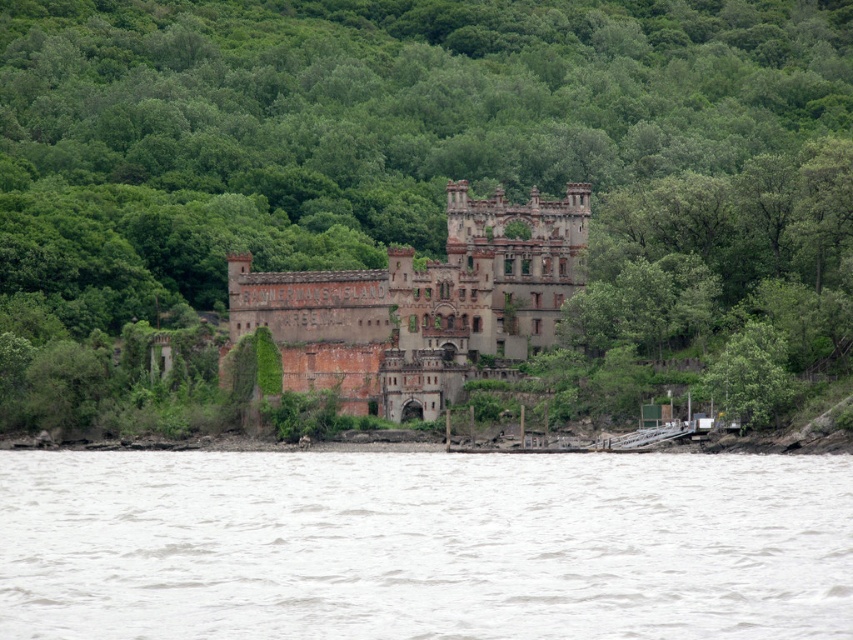
Question: Which of the following is the farthest from the observer?

Choices:
 (A) (294, 68)
 (B) (241, 305)
 (C) (535, 518)

Answer: (A)

Question: Does gray water at lower center appear under rusty brick castle at center?

Choices:
 (A) no
 (B) yes

Answer: (B)

Question: Does green leafy tree at center appear over rusty brick castle at center?

Choices:
 (A) yes
 (B) no

Answer: (A)

Question: Considering the real-world distances, which object is farthest from the rusty brick castle at center?

Choices:
 (A) green leafy tree at center
 (B) gray water at lower center

Answer: (B)

Question: Can you confirm if gray water at lower center is bigger than rusty brick castle at center?

Choices:
 (A) no
 (B) yes

Answer: (A)

Question: Which of the following is the farthest from the observer?

Choices:
 (A) (392, 525)
 (B) (494, 269)

Answer: (B)